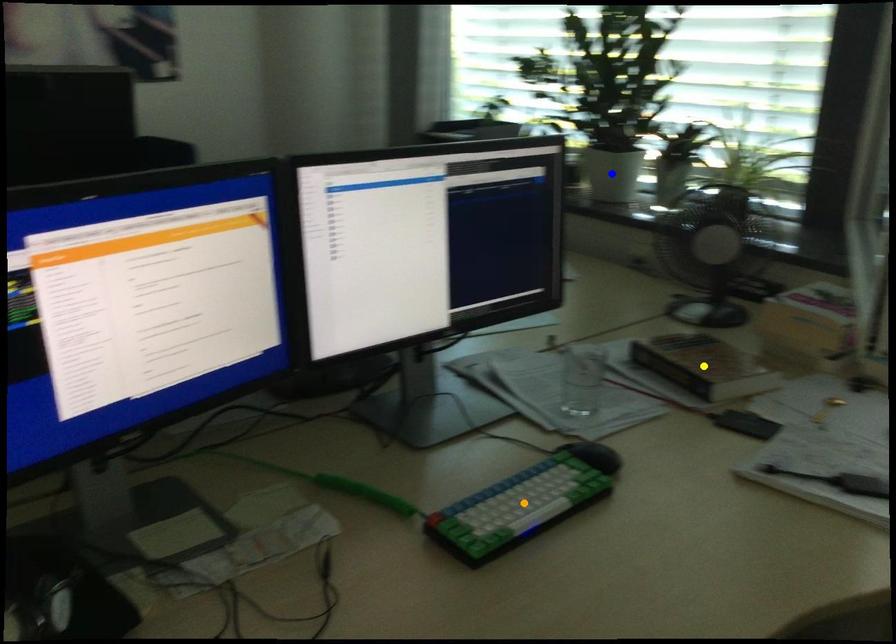
Order these from nearest to farthest:
orange point, blue point, yellow point

orange point, yellow point, blue point